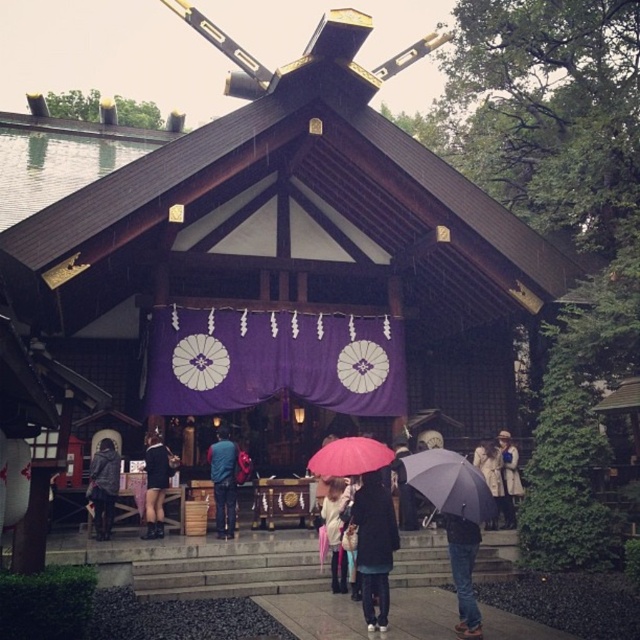
In the scene shown: Who is taller, white cotton scarf at center or dark blue fabric umbrella at center?

white cotton scarf at center is taller.

The width and height of the screenshot is (640, 640). Find the location of `white cotton scarf at center`. white cotton scarf at center is located at coordinates (333, 532).

Who is more forward, (x=330, y=486) or (x=401, y=516)?

Point (x=330, y=486) is more forward.

Find the location of a particular element. The height and width of the screenshot is (640, 640). white cotton scarf at center is located at coordinates (333, 532).

Is dark gray fabric umbrella at center smaller than black matte umbrella at lower center?

No.

Can you confirm if dark gray fabric umbrella at center is positioned below black matte umbrella at lower center?

Yes.

What do you see at coordinates (372, 547) in the screenshot?
I see `dark gray fabric umbrella at center` at bounding box center [372, 547].

The image size is (640, 640). Find the location of `dark gray fabric umbrella at center`. dark gray fabric umbrella at center is located at coordinates (372, 547).

Consider the image. Can you confirm if black matte umbrella at lower center is smaller than black leather shorts at center?

Correct, black matte umbrella at lower center occupies less space than black leather shorts at center.

Does point (440, 502) lie behind point (156, 433)?

No, it is in front of (156, 433).

Consider the image. Who is more forward, (474, 508) or (160, 474)?

Point (474, 508) is in front.

Where is `black matte umbrella at lower center`? The width and height of the screenshot is (640, 640). black matte umbrella at lower center is located at coordinates (451, 484).